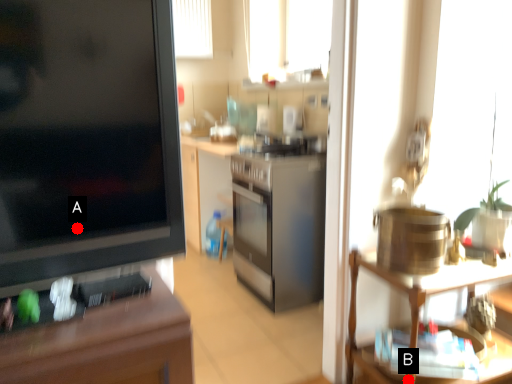
Question: Two points are circled on the image, labeled by A and B beside each circle. Which point is farther from the camera taking this photo?

Choices:
 (A) A is further
 (B) B is further

Answer: (B)